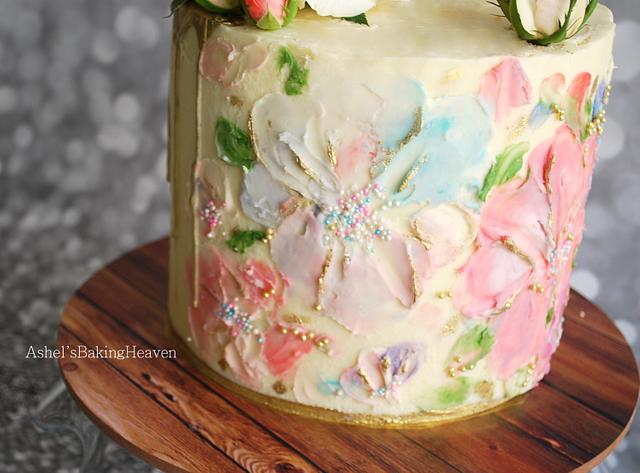
Locate an element on the screen. countertop under stand is located at coordinates (89, 448).